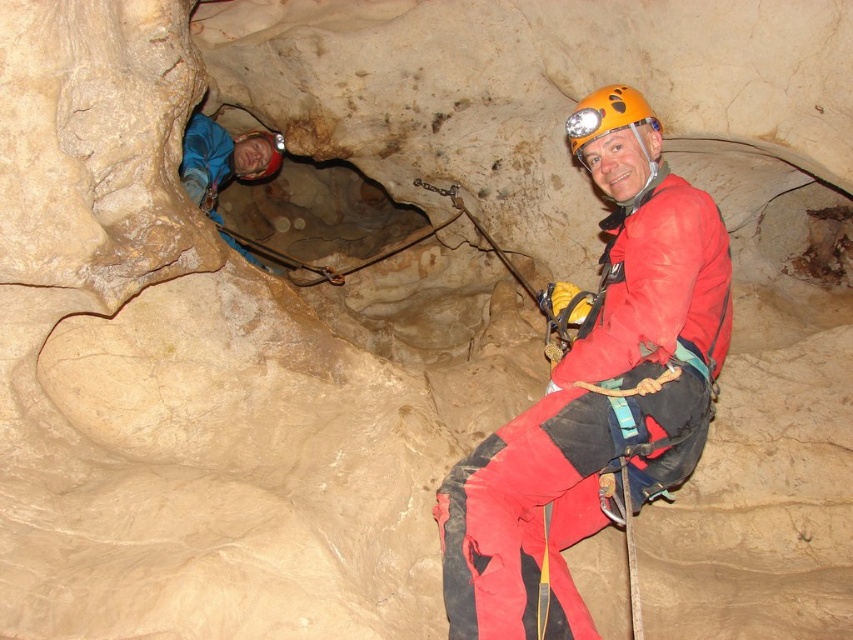
Between matte red jumpsuit at center and brushed metal helmet at upper center, which one is positioned lower?

matte red jumpsuit at center is below.

Where is `matte red jumpsuit at center`? This screenshot has width=853, height=640. matte red jumpsuit at center is located at coordinates (595, 406).

Does matte red jumpsuit at center have a lesser width compared to blue fabric helmet at upper left?

No.

Who is lower down, matte red jumpsuit at center or blue fabric helmet at upper left?

matte red jumpsuit at center

This screenshot has width=853, height=640. What do you see at coordinates (595, 406) in the screenshot?
I see `matte red jumpsuit at center` at bounding box center [595, 406].

Identify the location of matte red jumpsuit at center. (595, 406).

Which is above, blue fabric helmet at upper left or brushed metal helmet at upper center?

brushed metal helmet at upper center

Is blue fabric helmet at upper left positioned before brushed metal helmet at upper center?

Yes.

I want to click on blue fabric helmet at upper left, so click(x=222, y=161).